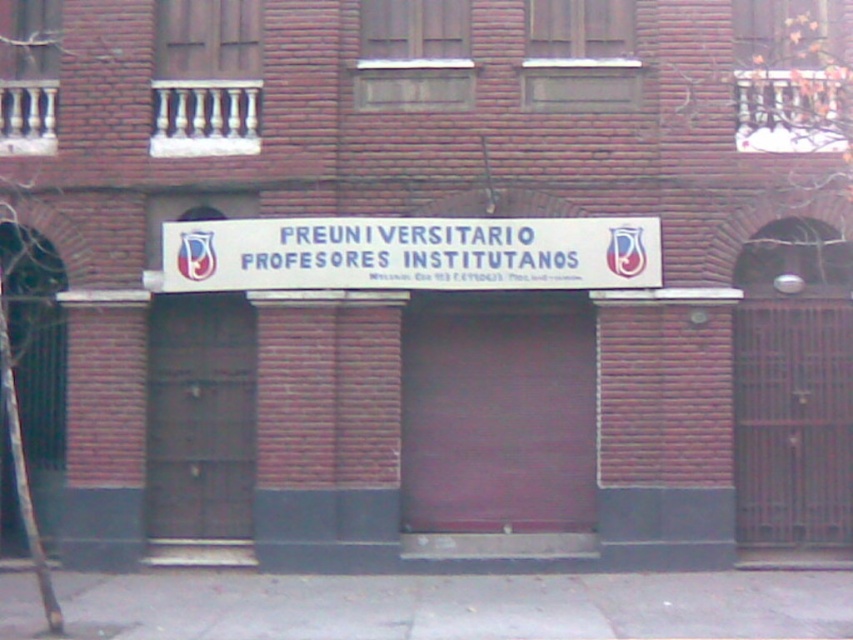
Question: Does gray concrete pavement at lower center have a smaller size compared to white plastic sign at center?

Choices:
 (A) yes
 (B) no

Answer: (A)

Question: Among these objects, which one is nearest to the camera?

Choices:
 (A) gray concrete pavement at lower center
 (B) white plastic sign at center

Answer: (A)

Question: Which of the following is the farthest from the observer?

Choices:
 (A) (846, 624)
 (B) (490, 248)

Answer: (B)

Question: Can you confirm if gray concrete pavement at lower center is positioned above white plastic sign at center?

Choices:
 (A) no
 (B) yes

Answer: (A)

Question: Considering the relative positions of gray concrete pavement at lower center and white plastic sign at center in the image provided, where is gray concrete pavement at lower center located with respect to white plastic sign at center?

Choices:
 (A) left
 (B) right

Answer: (B)